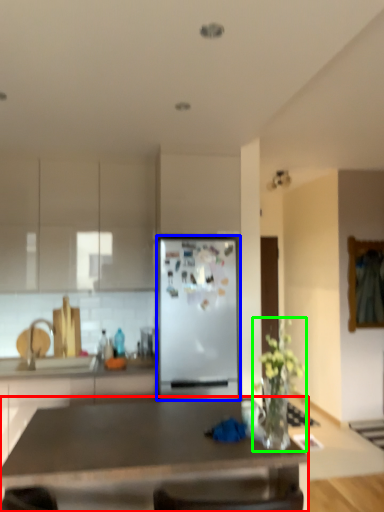
Question: Which is farther away from desk (highlighted by a red box)? refrigerator (highlighted by a blue box) or houseplant (highlighted by a green box)?

Choices:
 (A) refrigerator
 (B) houseplant

Answer: (A)